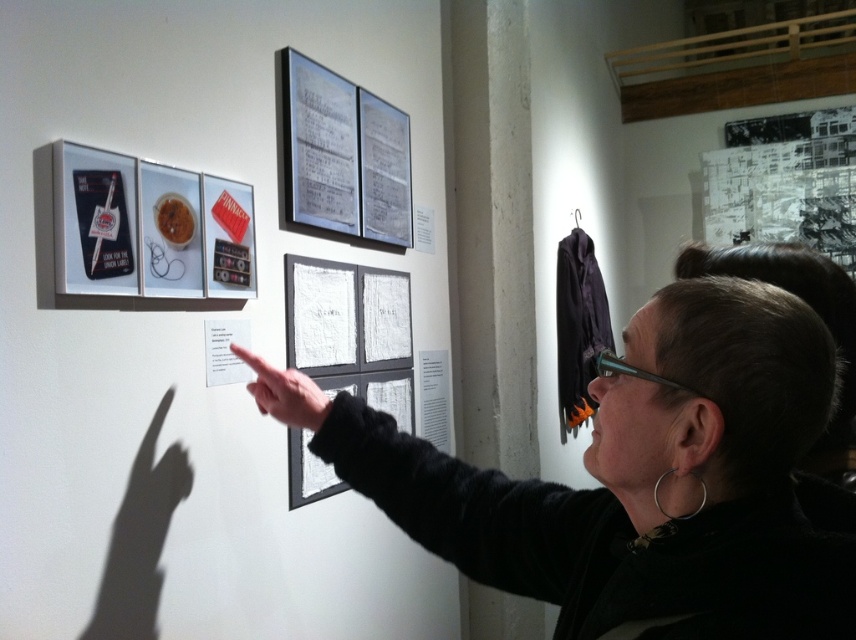
How far apart are black fabric at center and transparent plastic glasses at upper center?

black fabric at center is 9.94 inches away from transparent plastic glasses at upper center.

This screenshot has height=640, width=856. Describe the element at coordinates (635, 480) in the screenshot. I see `black fabric at center` at that location.

At what (x,y) coordinates should I click in order to perform the action: click on black fabric at center. Please return your answer as a coordinate pair (x, y). Image resolution: width=856 pixels, height=640 pixels. Looking at the image, I should click on (635, 480).

The width and height of the screenshot is (856, 640). Identify the location of black fabric at center. (635, 480).